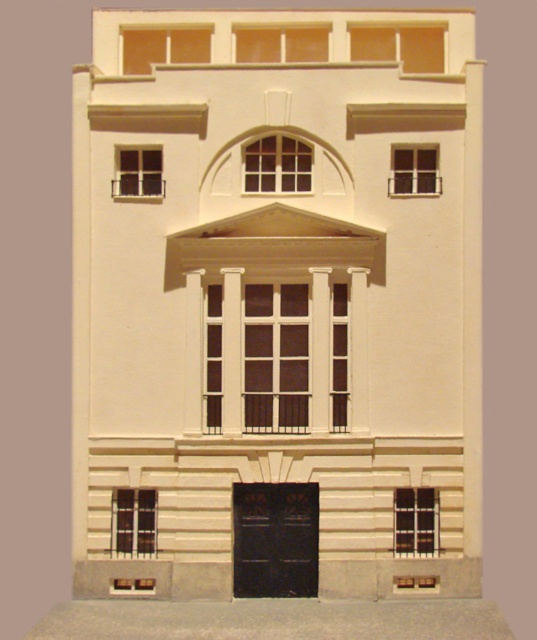
Is matte glass window at center thinner than matte glass window at upper right?

No.

Is point (331, 428) in front of point (417, 192)?

Yes, point (331, 428) is in front of point (417, 192).

Where is `matte glass window at center`? This screenshot has width=537, height=640. matte glass window at center is located at coordinates (275, 356).

Is matte black window at lower left behind matte glass window at upper right?

No, matte black window at lower left is in front of matte glass window at upper right.

Between matte black window at lower left and matte glass window at upper right, which one is positioned higher?

matte glass window at upper right is above.

What do you see at coordinates (134, 522) in the screenshot?
I see `matte black window at lower left` at bounding box center [134, 522].

This screenshot has height=640, width=537. I want to click on matte black window at lower left, so click(134, 522).

Does matte glass window at center have a lesser width compared to matte black window at lower left?

No.

Between point (249, 390) and point (137, 529), which one is positioned in front?

Point (137, 529) is more forward.

Identify the location of matte glass window at center. (275, 356).